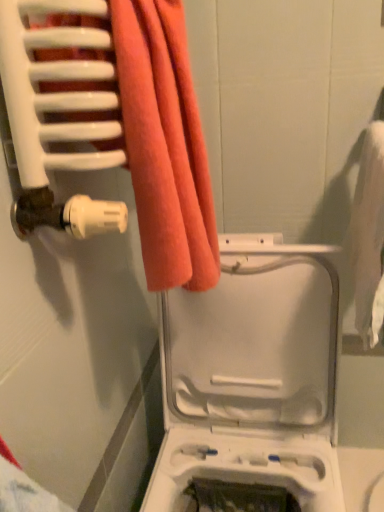
This screenshot has height=512, width=384. Describe the element at coordinates (165, 145) in the screenshot. I see `coral soft towel at upper left` at that location.

In order to click on coral soft towel at upper left in this screenshot , I will do `click(165, 145)`.

Find the location of a particular element. coral soft towel at upper left is located at coordinates (165, 145).